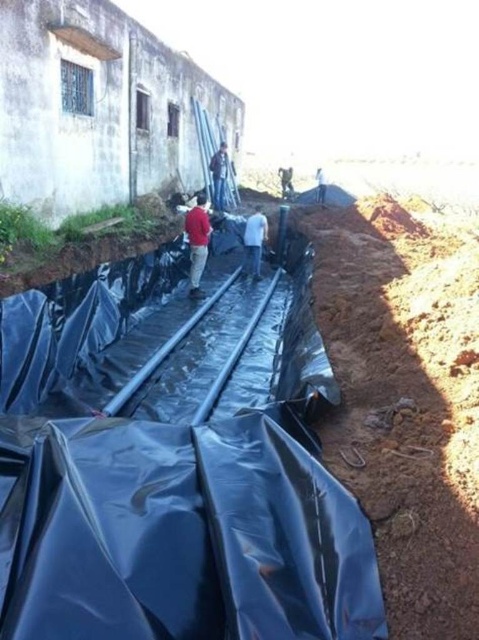
Question: Which point is closer to the camera?

Choices:
 (A) (193, 236)
 (B) (254, 275)
 (C) (322, 188)
 (D) (221, 180)

Answer: (A)

Question: Which of the following is the farthest from the observer?

Choices:
 (A) white matte shirt at center
 (B) white fabric bag at center
 (C) blue jeans at center

Answer: (B)

Question: Is red matte shirt at center further to camera compared to white fabric bag at center?

Choices:
 (A) no
 (B) yes

Answer: (A)

Question: Which of these objects is positioned farthest from the white matte shirt at center?

Choices:
 (A) white fabric bag at center
 (B) blue jeans at center

Answer: (A)

Question: Is white matte shirt at center closer to the viewer compared to white fabric bag at center?

Choices:
 (A) yes
 (B) no

Answer: (A)

Question: Does red matte shirt at center have a larger size compared to white matte shirt at center?

Choices:
 (A) yes
 (B) no

Answer: (B)